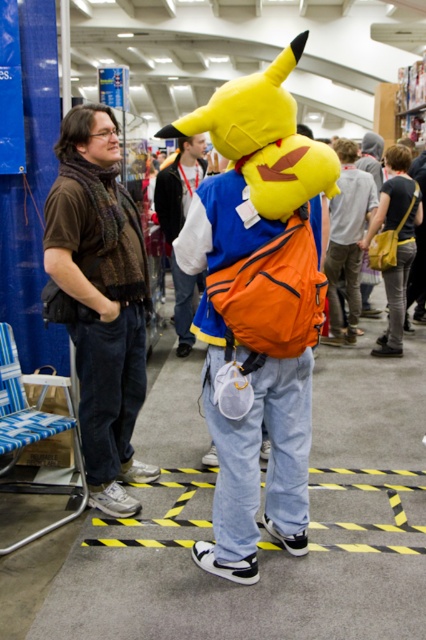
Between point (331, 246) and point (181, 272), which one is positioned behind?

Positioned behind is point (331, 246).

Who is taller, denim pants at center or orange fabric backpack at center?

denim pants at center is taller.

Does point (339, 262) come in front of point (180, 172)?

That is False.

This screenshot has height=640, width=426. I want to click on denim pants at center, so click(x=347, y=240).

Does brown woven scarf at left appear on the right side of denim pants at center?

Incorrect, brown woven scarf at left is not on the right side of denim pants at center.

Who is higher up, brown woven scarf at left or denim pants at center?

Positioned higher is denim pants at center.

Which is in front, point (88, 369) or point (348, 156)?

Positioned in front is point (88, 369).

Image resolution: width=426 pixels, height=640 pixels. Identify the location of brown woven scarf at left. click(x=100, y=298).

Which is more to the right, brown woven scarf at left or orange fabric backpack at center?

From the viewer's perspective, orange fabric backpack at center appears more on the right side.

Can you confirm if brown woven scarf at left is bigger than orange fabric backpack at center?

Incorrect, brown woven scarf at left is not larger than orange fabric backpack at center.

This screenshot has width=426, height=640. Identify the location of brown woven scarf at left. (100, 298).